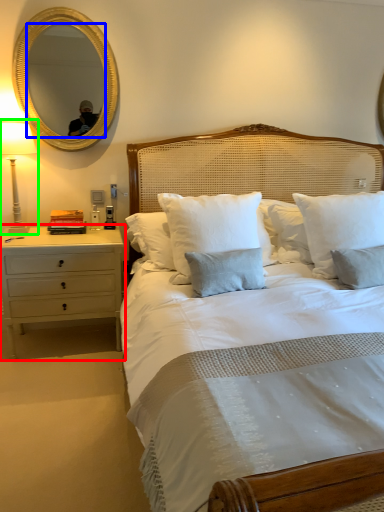
Question: Considering the real-world distances, which object is farthest from nightstand (highlighted by a red box)? mirror (highlighted by a blue box) or bedside lamp (highlighted by a green box)?

Choices:
 (A) mirror
 (B) bedside lamp

Answer: (A)